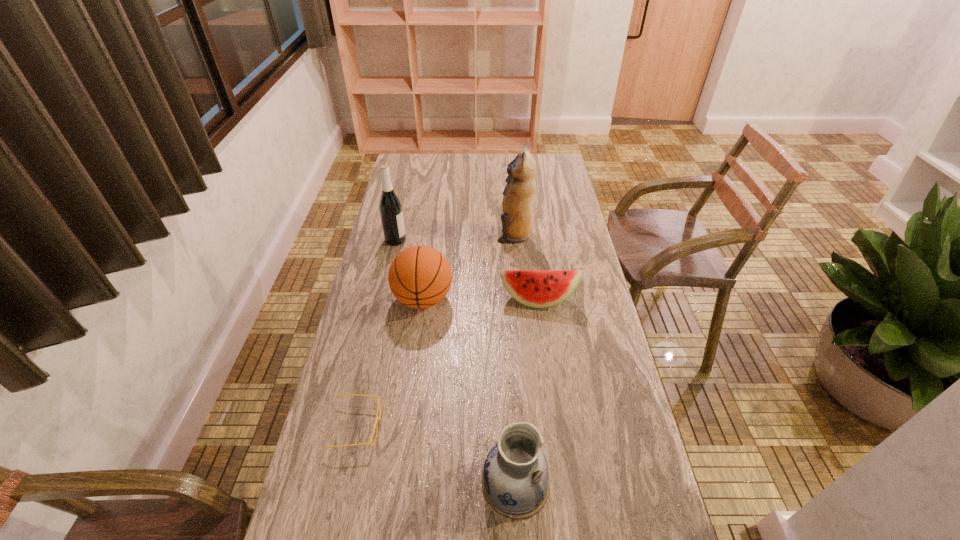
The width and height of the screenshot is (960, 540). Identify the location of the tallest object. (516, 219).

This screenshot has height=540, width=960. Find the location of `wine bottle`. wine bottle is located at coordinates (390, 207).

You are a GUI agent. You are given a task and a screenshot of the screen. Output one action in this format:
    pyautogui.click(x=<x>, y=<y>)
    Task: Click on the pottery
    
    Given the screenshot: What is the action you would take?
    pyautogui.click(x=515, y=481)

Where is `basketball`? This screenshot has height=540, width=960. basketball is located at coordinates (419, 276).

Where is `watermelon`? This screenshot has height=540, width=960. watermelon is located at coordinates (535, 288).

You are a GUI agent. You are given a task and a screenshot of the screen. Output one action in this format:
    pyautogui.click(x=<x>, y=<y>)
    Task: Click on the spectacles
    
    Given the screenshot: What is the action you would take?
    pyautogui.click(x=379, y=405)

Identify the location of free spot located 0.120m on the face of the cat. The height and width of the screenshot is (540, 960). (467, 234).

This screenshot has width=960, height=540. I want to click on free space located 0.230m on the face of the cat, so click(438, 234).

Find the location of a particular element. vacant space situated on the face of the cat is located at coordinates (448, 234).

At what (x,y) coordinates should I click in order to perform the action: click on vacant position located on the label of the wine bottle. Please return your answer as a coordinate pair (x, y). This screenshot has height=540, width=960. Looking at the image, I should click on (487, 240).